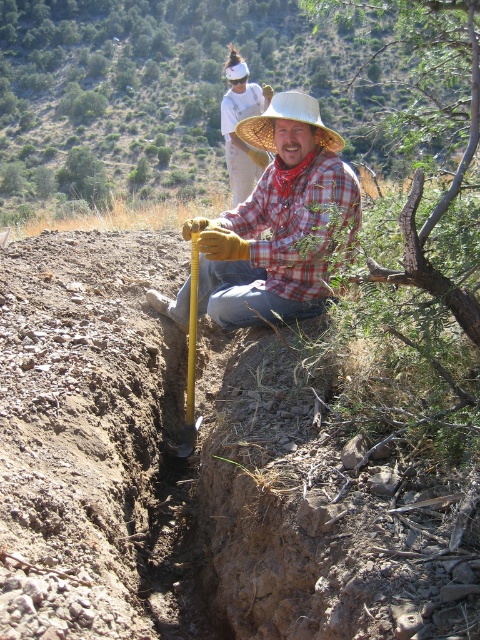
Question: Among these objects, which one is farthest from the camera?

Choices:
 (A) woven straw cowboy hat at center
 (B) matte plaid shirt at center

Answer: (A)

Question: Can you confirm if white cotton shirt at upper center is positioned below woven straw cowboy hat at center?

Choices:
 (A) no
 (B) yes

Answer: (A)

Question: In this image, where is woven straw cowboy hat at center located relative to yellow plastic shovel at center?

Choices:
 (A) right
 (B) left

Answer: (A)

Question: Can you confirm if white cotton shirt at upper center is smaller than yellow plastic shovel at center?

Choices:
 (A) no
 (B) yes

Answer: (A)

Question: Which point is farther from the camera taking this photo?

Choices:
 (A) (227, 148)
 (B) (183, 305)

Answer: (A)

Question: Estimate the real-world distances between objects in this image. Which object is farther from the green leafy tree at upper center?

Choices:
 (A) white cotton shirt at upper center
 (B) woven straw cowboy hat at center

Answer: (B)